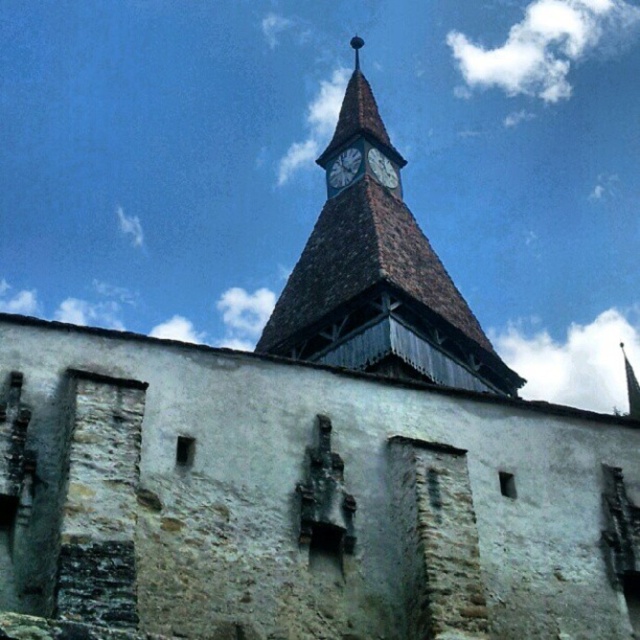
Question: Does brown wooden clock tower at upper center appear under dark gray stone clock at upper center?

Choices:
 (A) no
 (B) yes

Answer: (A)

Question: Does dark gray stone clock at upper center appear on the left side of white stone clock at upper center?

Choices:
 (A) no
 (B) yes

Answer: (B)

Question: Among these points, which one is nearest to the camera?

Choices:
 (A) (378, 179)
 (B) (451, 324)

Answer: (B)

Question: Can you confirm if brown wooden clock tower at upper center is bigger than white stone clock at upper center?

Choices:
 (A) yes
 (B) no

Answer: (A)

Question: Which is nearer to the brown wooden clock tower at upper center?

Choices:
 (A) dark gray stone clock at upper center
 (B) white stone clock at upper center

Answer: (B)

Question: Which object appears closest to the camera in this image?

Choices:
 (A) brown wooden clock tower at upper center
 (B) white stone clock at upper center

Answer: (A)